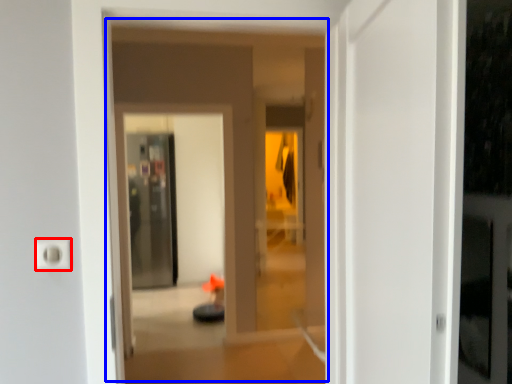
Question: Which object is further to the camera taking this photo, electric outlet (highlighted by a red box) or hotel lobby (highlighted by a blue box)?

Choices:
 (A) electric outlet
 (B) hotel lobby

Answer: (A)